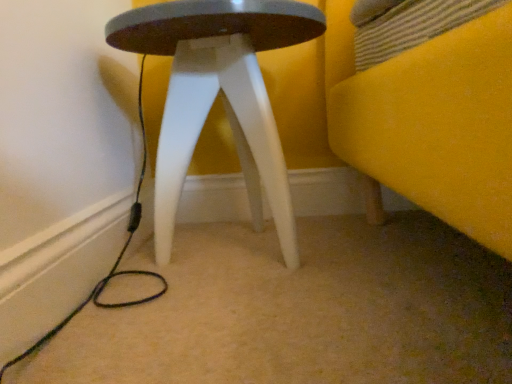
Locate an element on the screen. vacant region in front of black cable at lower left is located at coordinates (138, 323).